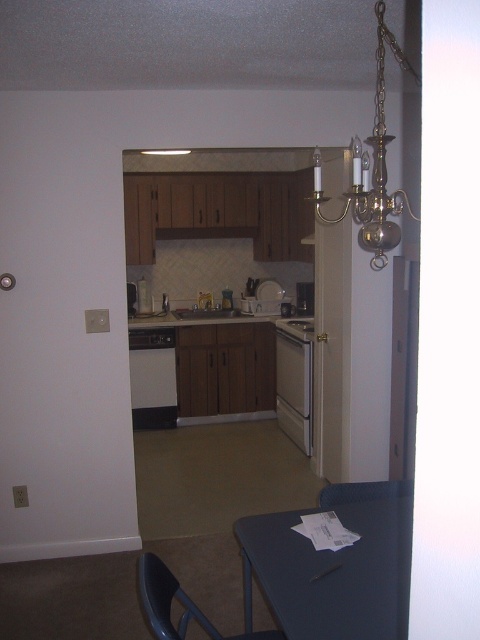
You are a person who is 160 cm tall. You want to place a small vase on the blue plastic table at lower center and the white glossy stove at center. Which surface will require you to stand on a stool to reach it?

The blue plastic table at lower center is much taller than the white glossy stove at center. Since you are 160 cm tall, you would need to stand on a stool to reach the blue plastic table at lower center to place the vase.